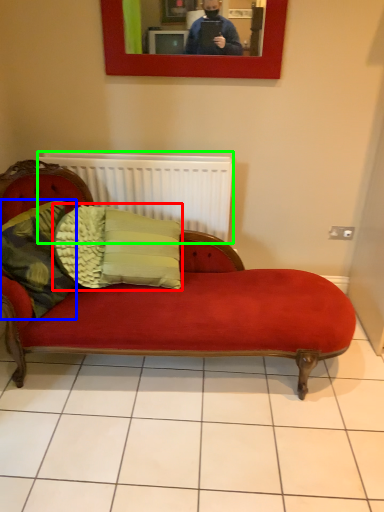
Question: Which is nearer to the pillow (highlighted by a red box)? pillow (highlighted by a blue box) or radiator (highlighted by a green box).

Choices:
 (A) pillow
 (B) radiator

Answer: (A)